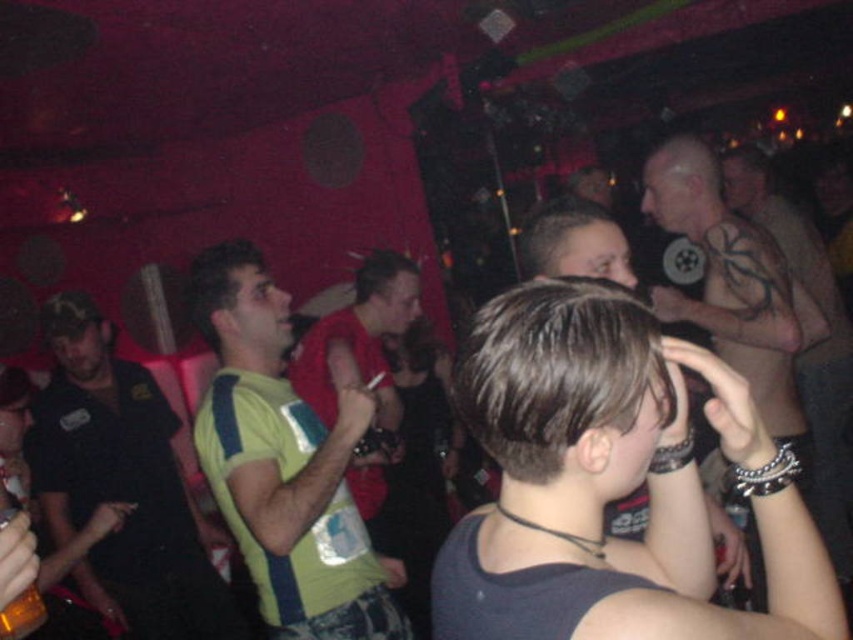
You are a photographer at the nightclub scene. You want to take a photo that includes both the person in the yellow shirt with blue accents and the person in the red shirt. However, you notice two points marked in the image at coordinates point (668, 144) and point (28, 609). Which of these points is closer to the camera, and how does this affect your composition?

Point (668, 144) is further from the camera than point (28, 609). This means that when composing your photo, the point closer to the camera will appear larger and more prominent in the frame, potentially drawing attention away from the subjects you want to highlight.